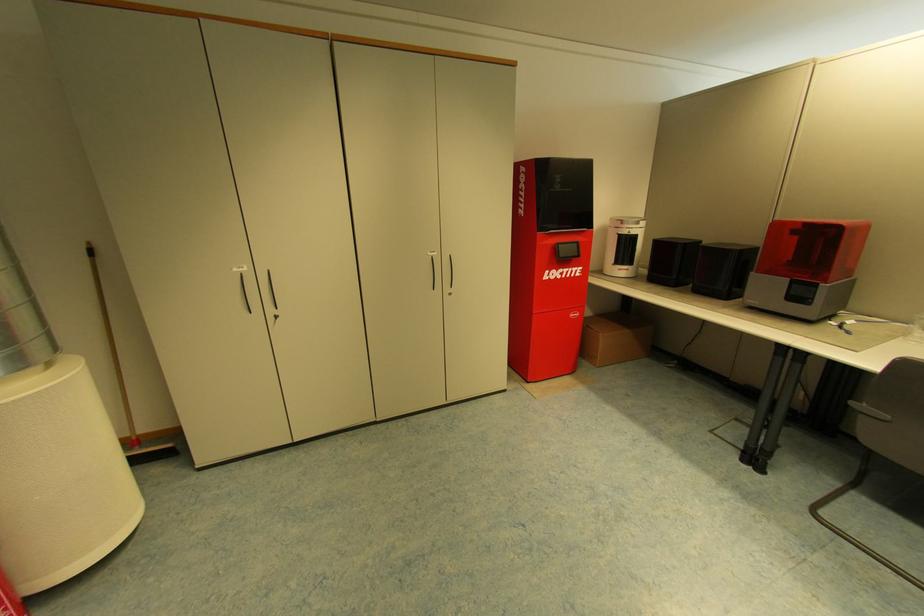
Locate an element on the screen. red printer cover is located at coordinates (812, 249).